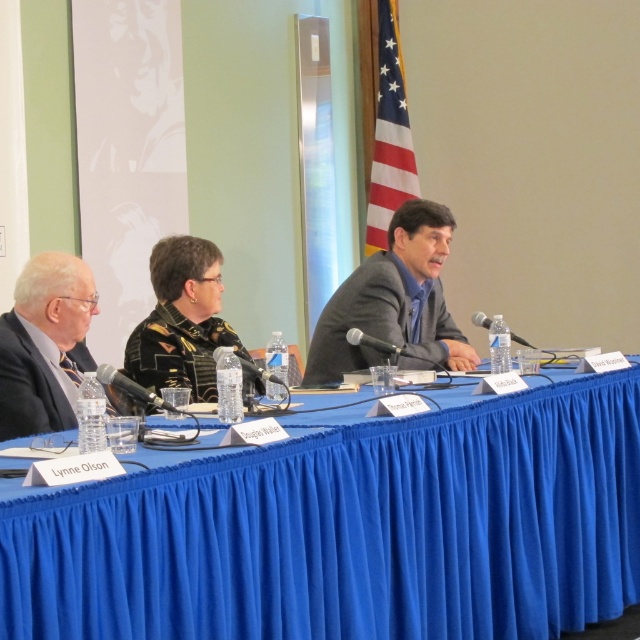
Question: Among these points, which one is farthest from the camera?

Choices:
 (A) (372, 424)
 (B) (20, 346)

Answer: (B)

Question: Is gray suit at center bigger than matte black suit at left?

Choices:
 (A) yes
 (B) no

Answer: (A)

Question: Is matte black suit at left positioned behind black leather jacket at center?

Choices:
 (A) yes
 (B) no

Answer: (B)

Question: Does blue fabric table at center have a lesser width compared to gray suit at center?

Choices:
 (A) yes
 (B) no

Answer: (B)

Question: Among these objects, which one is farthest from the camera?

Choices:
 (A) blue fabric table at center
 (B) black leather jacket at center

Answer: (B)

Question: Which of the following is the farthest from the observer?

Choices:
 (A) gray suit at center
 (B) blue fabric table at center

Answer: (A)